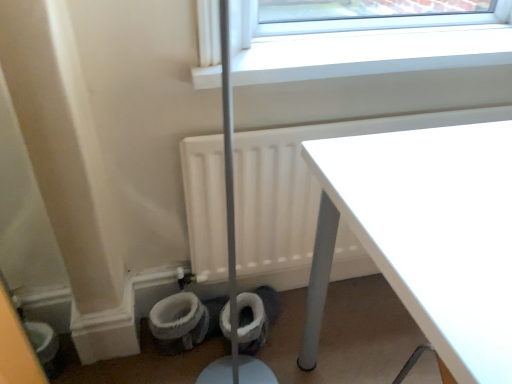
Question: From the image's perspective, is white glossy table at upper right below white plastic window sill at upper center?

Choices:
 (A) no
 (B) yes

Answer: (B)

Question: Is white glossy table at upper right positioned far away from white plastic window sill at upper center?

Choices:
 (A) yes
 (B) no

Answer: (B)

Question: Is white glossy table at upper right shorter than white plastic window sill at upper center?

Choices:
 (A) yes
 (B) no

Answer: (B)

Question: Does white glossy table at upper right contain white plastic window sill at upper center?

Choices:
 (A) yes
 (B) no

Answer: (B)

Question: Considering the relative sizes of white glossy table at upper right and white plastic window sill at upper center in the image provided, is white glossy table at upper right smaller than white plastic window sill at upper center?

Choices:
 (A) yes
 (B) no

Answer: (B)

Question: Is white glossy table at upper right directly adjacent to white plastic window sill at upper center?

Choices:
 (A) no
 (B) yes

Answer: (A)

Question: Can you confirm if white fluffy toilet paper at lower center is positioned to the left of white fabric toilet bowl at lower left?

Choices:
 (A) no
 (B) yes

Answer: (A)

Question: Does white fluffy toilet paper at lower center lie in front of white fabric toilet bowl at lower left?

Choices:
 (A) yes
 (B) no

Answer: (A)

Question: Is white fluffy toilet paper at lower center wider than white fabric toilet bowl at lower left?

Choices:
 (A) no
 (B) yes

Answer: (A)

Question: Could you tell me if white fluffy toilet paper at lower center is facing white fabric toilet bowl at lower left?

Choices:
 (A) no
 (B) yes

Answer: (B)

Question: Is white fluffy toilet paper at lower center to the right of white fabric toilet bowl at lower left from the viewer's perspective?

Choices:
 (A) no
 (B) yes

Answer: (B)

Question: From a real-world perspective, is white fluffy toilet paper at lower center under white fabric toilet bowl at lower left?

Choices:
 (A) yes
 (B) no

Answer: (B)

Question: Does white plastic window sill at upper center have a greater height compared to white matte radiator at lower left?

Choices:
 (A) yes
 (B) no

Answer: (B)